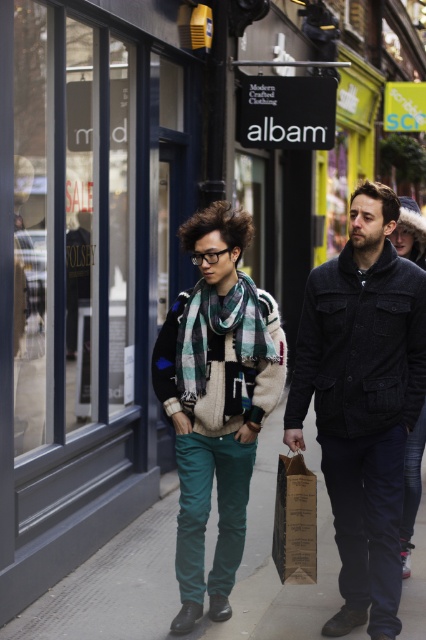
Does dark woolen jacket at center have a greater width compared to teal fabric pants at lower center?

No, dark woolen jacket at center is not wider than teal fabric pants at lower center.

From the picture: Who is more distant from viewer, (371, 317) or (48, 595)?

Positioned behind is point (48, 595).

Does point (344, 589) lie behind point (363, 634)?

That is True.

In order to click on dark woolen jacket at center in this screenshot , I will do `click(362, 401)`.

Between teal fabric pants at lower center and green plaid scarf at center, which one is positioned higher?

Positioned higher is green plaid scarf at center.

Based on the photo, between teal fabric pants at lower center and green plaid scarf at center, which one has more height?

Standing taller between the two is green plaid scarf at center.

Between point (137, 588) and point (238, 292), which one is positioned in front?

Point (238, 292)

Identify the location of teal fabric pants at lower center. This screenshot has width=426, height=640. (175, 577).

Consider the image. Between dark woolen jacket at center and brown paper bag at center, which one appears on the right side from the viewer's perspective?

Positioned to the right is dark woolen jacket at center.

Is point (417, 292) positioned before point (313, 474)?

That is True.

Identify the location of dark woolen jacket at center. (362, 401).